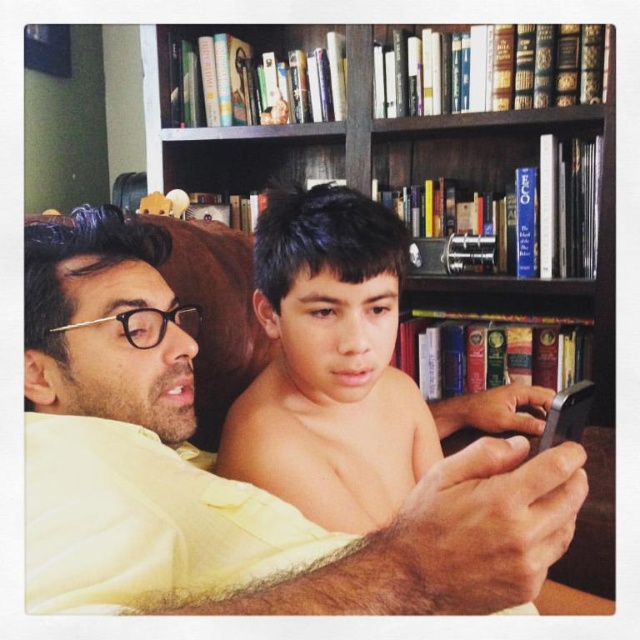
From the picture: You are an interior designer planning to place a new decorative item between the matte yellow shirt at center and the wooden bookshelf at upper center. Which object should the item be placed closer to based on their widths?

The matte yellow shirt at center is thinner than the wooden bookshelf at upper center, so the decorative item should be placed closer to the matte yellow shirt at center to maintain balance between the two objects.